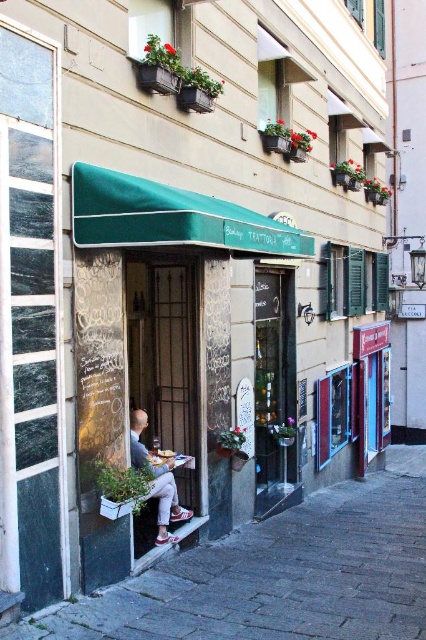
Question: Considering the relative positions of paved stone pavement at lower center and light gray fabric pants at lower center in the image provided, where is paved stone pavement at lower center located with respect to light gray fabric pants at lower center?

Choices:
 (A) right
 (B) left

Answer: (A)

Question: Is paved stone pavement at lower center bigger than light gray fabric pants at lower center?

Choices:
 (A) yes
 (B) no

Answer: (A)

Question: Is paved stone pavement at lower center closer to the viewer compared to light gray fabric pants at lower center?

Choices:
 (A) no
 (B) yes

Answer: (B)

Question: Which object appears closest to the camera in this image?

Choices:
 (A) paved stone pavement at lower center
 (B) light gray fabric pants at lower center

Answer: (A)